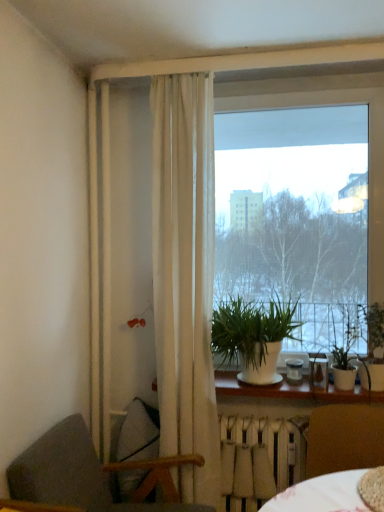
At what (x,y) coordinates should I click in order to perform the action: click on vacant area on top of white sheer curtain at center (from a real-world perspective). Please return your answer as a coordinate pair (x, y). The height and width of the screenshot is (512, 384). Looking at the image, I should click on (183, 54).